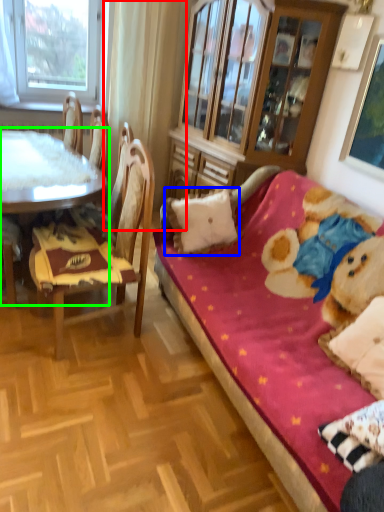
Question: Which is nearer to the curtain (highlighted by a red box)? pillow (highlighted by a blue box) or table (highlighted by a green box).

Choices:
 (A) pillow
 (B) table

Answer: (B)